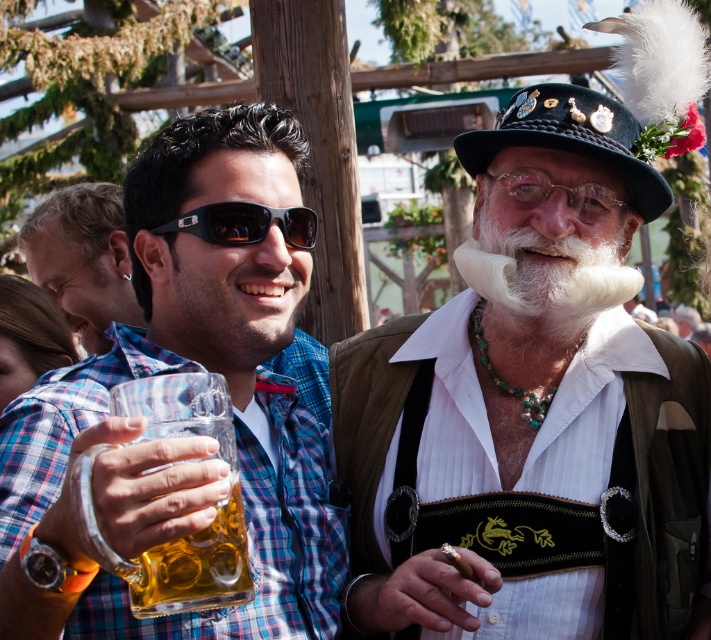
You are a photographer standing at the camera position. You want to take a closeup photo of the white fabric vest at center. Can you estimate how far you need to move forward to get the vest into focus without zooming?

The white fabric vest at center is 11.01 meters from the camera. To focus on it without zooming, you would need to move forward approximately 11.01 meters to be close enough.

You are a photographer at the event and want to capture both the white fluffy beard at center and the black matte sunglasses at center in a single photo. The camera you are using has a maximum focus range of 2.5 meters. Can you fit both objects in the frame without moving the camera?

The white fluffy beard at center and black matte sunglasses at center are 2.49 meters apart. Since the distance between them is within the camera maximum focus range of 2.5 meters, you can fit both objects in the frame without moving the camera.